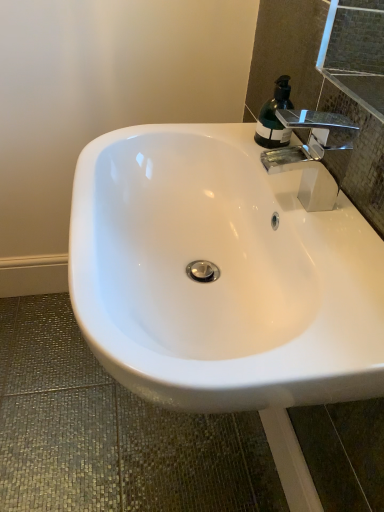
At what (x,y) coordinates should I click in order to perform the action: click on vacant point to the left of translucent green bottle at upper right. Please return your answer as a coordinate pair (x, y). This screenshot has width=384, height=512. Looking at the image, I should click on (215, 134).